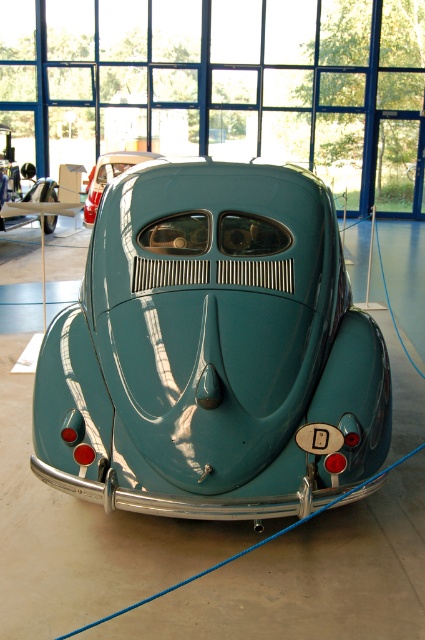
Between glossy teal car at center and teal glossy car at center, which one is positioned higher?

Positioned higher is teal glossy car at center.

Does glossy teal car at center have a smaller size compared to teal glossy car at center?

Incorrect, glossy teal car at center is not smaller in size than teal glossy car at center.

Is point (317, 369) farther from viewer compared to point (93, 188)?

No, (317, 369) is closer to viewer.

Find the location of a particular element. The height and width of the screenshot is (640, 425). glossy teal car at center is located at coordinates (212, 352).